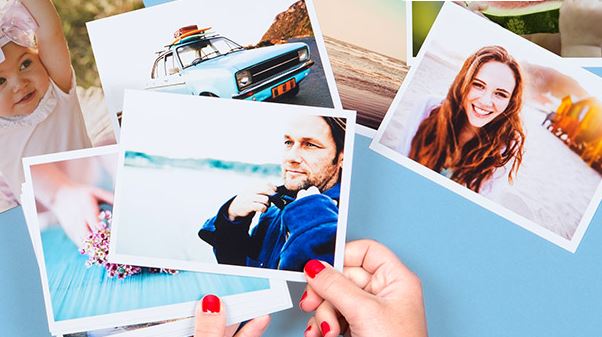
The width and height of the screenshot is (602, 337). I want to click on pictures, so click(x=91, y=265), click(x=53, y=112), click(x=160, y=35), click(x=368, y=57), click(x=416, y=23), click(x=439, y=74), click(x=110, y=327).